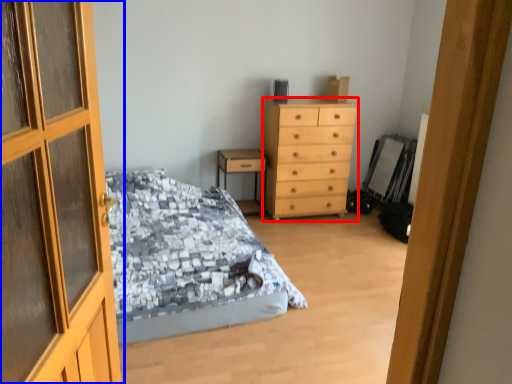
Question: Which point is further to the camera, chest of drawers (highlighted by a red box) or door (highlighted by a blue box)?

Choices:
 (A) chest of drawers
 (B) door

Answer: (A)